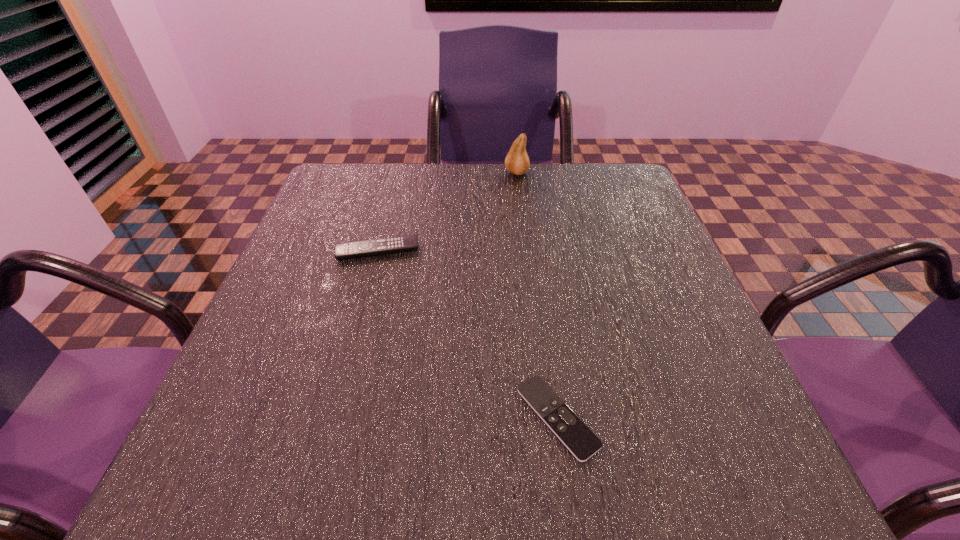
Where is `the tallest object`? Image resolution: width=960 pixels, height=540 pixels. the tallest object is located at coordinates (x=517, y=162).

The image size is (960, 540). Identify the location of pear. [517, 162].

What are the coordinates of `the second shortest object` in the screenshot? It's located at (355, 249).

You are a GUI agent. You are given a task and a screenshot of the screen. Output one action in this format:
    pyautogui.click(x=<x>, y=<y>)
    Task: Click on the farther remote control
    The width and height of the screenshot is (960, 540).
    Given the screenshot: What is the action you would take?
    pyautogui.click(x=355, y=249)

The height and width of the screenshot is (540, 960). Identify the location of the shorter remote control. (566, 425).

At what (x,y) coordinates should I click in order to perform the action: click on the nearest object. Please return your answer as a coordinate pair (x, y). Image resolution: width=960 pixels, height=540 pixels. Looking at the image, I should click on (566, 425).

Find the location of `vacant position located 0.280m on the left of the farthest object`. vacant position located 0.280m on the left of the farthest object is located at coordinates (403, 173).

You are a GUI agent. You are given a task and a screenshot of the screen. Output one action in this format:
    pyautogui.click(x=<x>, y=<y>)
    Task: Click on the vacant space located 0.080m on the left of the leftmost object
    The height and width of the screenshot is (540, 960).
    Given the screenshot: What is the action you would take?
    [x=300, y=251]

The height and width of the screenshot is (540, 960). Identify the location of free space located 0.220m on the back of the shortest object. (539, 286).

I want to click on object that is positioned at the far edge, so click(x=517, y=162).